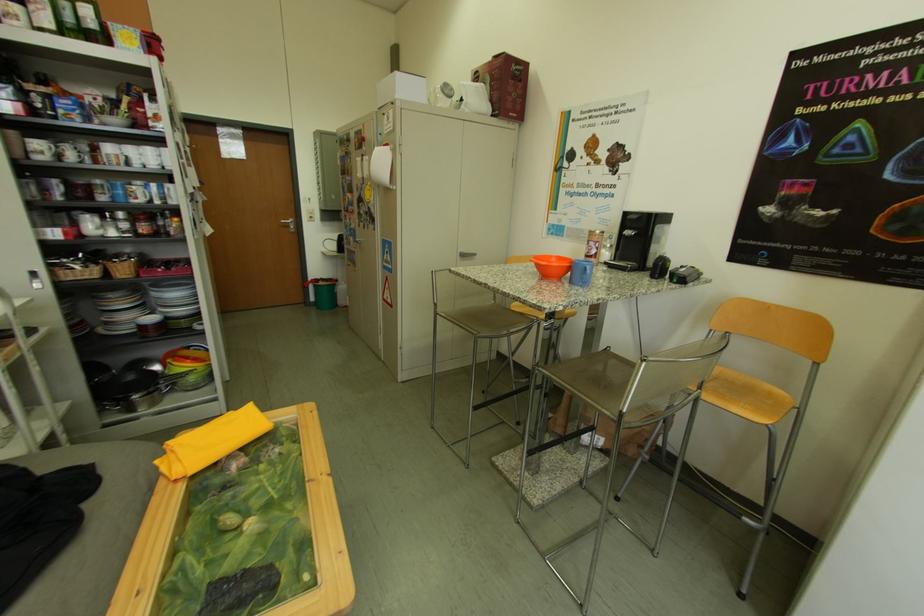
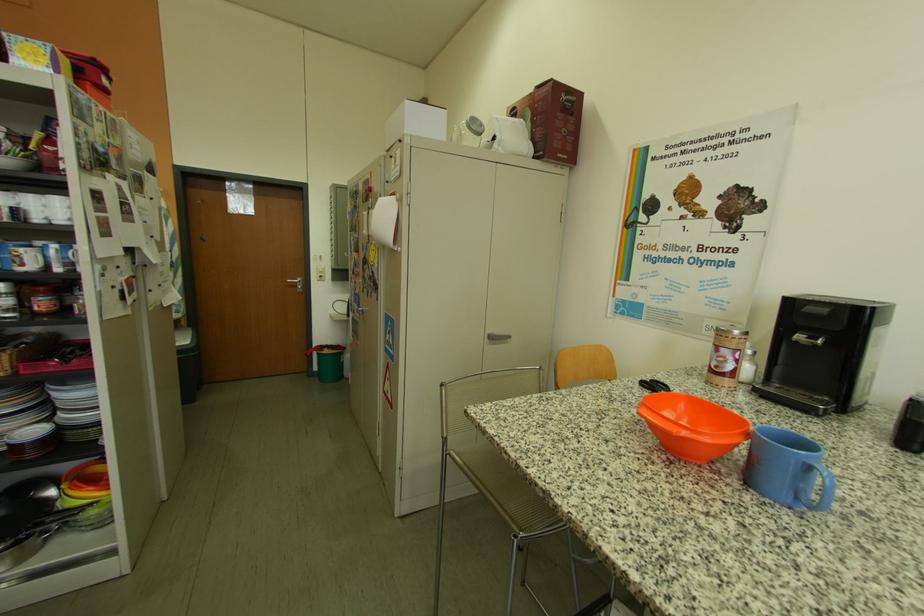
Question: The images are taken continuously from a first-person perspective. In which direction is your viewpoint rotating?

Choices:
 (A) Left
 (B) Right
 (C) Up
 (D) Down

Answer: (C)